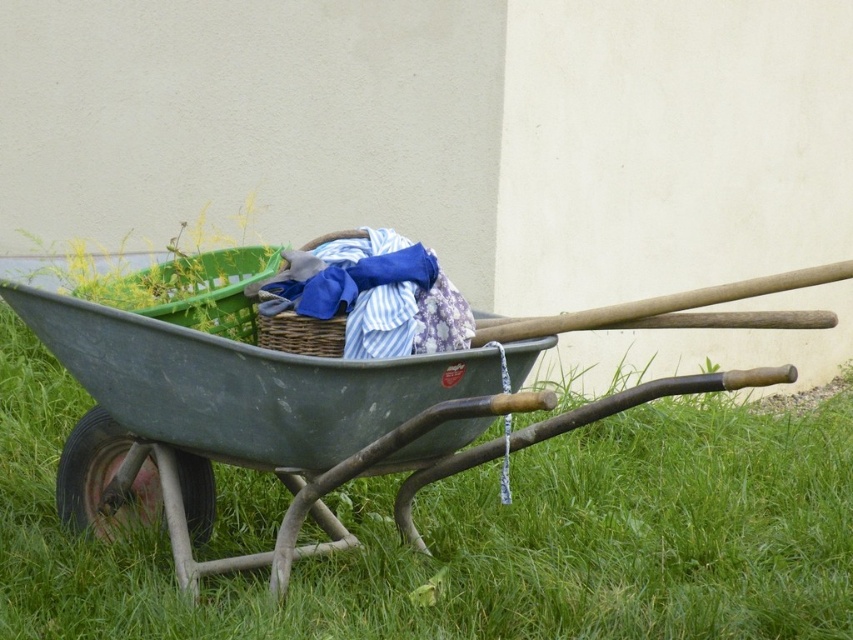
Is blue striped fabric at center wider than woven brown basket at center?

Correct, the width of blue striped fabric at center exceeds that of woven brown basket at center.

Does blue striped fabric at center lie in front of woven brown basket at center?

Yes, blue striped fabric at center is in front of woven brown basket at center.

Is point (315, 285) farther from viewer compared to point (312, 339)?

That is True.

I want to click on blue striped fabric at center, so click(374, 296).

This screenshot has height=640, width=853. Find the location of `green metal wheelbarrow at center`. green metal wheelbarrow at center is located at coordinates (254, 424).

Which is more to the right, green metal wheelbarrow at center or blue striped fabric at center?

Positioned to the right is blue striped fabric at center.

Locate an element on the screen. green metal wheelbarrow at center is located at coordinates (254, 424).

Can you confirm if green metal wheelbarrow at center is bigger than woven brown basket at center?

Correct, green metal wheelbarrow at center is larger in size than woven brown basket at center.

Does green metal wheelbarrow at center appear on the left side of woven brown basket at center?

Incorrect, green metal wheelbarrow at center is not on the left side of woven brown basket at center.

Does point (309, 410) lie in front of point (334, 237)?

Yes.

Where is `green metal wheelbarrow at center`? This screenshot has width=853, height=640. green metal wheelbarrow at center is located at coordinates (254, 424).